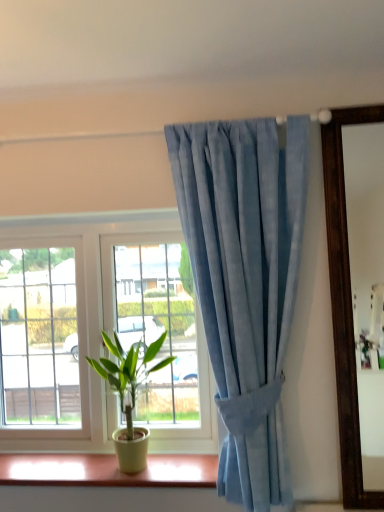
Question: Is light blue fabric curtain at upper center wider than matte yellow plastic at lower center?

Choices:
 (A) yes
 (B) no

Answer: (B)

Question: From the image's perspective, does light blue fabric curtain at upper center appear higher than matte yellow plastic at lower center?

Choices:
 (A) yes
 (B) no

Answer: (A)

Question: Considering the relative positions of light blue fabric curtain at upper center and matte yellow plastic at lower center in the image provided, is light blue fabric curtain at upper center to the left of matte yellow plastic at lower center from the viewer's perspective?

Choices:
 (A) no
 (B) yes

Answer: (A)

Question: Would you consider light blue fabric curtain at upper center to be distant from matte yellow plastic at lower center?

Choices:
 (A) yes
 (B) no

Answer: (B)

Question: Is light blue fabric curtain at upper center behind matte yellow plastic at lower center?

Choices:
 (A) no
 (B) yes

Answer: (A)

Question: Is matte yellow plastic at lower center situated inside green matte plant at lower left or outside?

Choices:
 (A) inside
 (B) outside

Answer: (B)

Question: Considering the positions of matte yellow plastic at lower center and green matte plant at lower left in the image, is matte yellow plastic at lower center taller or shorter than green matte plant at lower left?

Choices:
 (A) tall
 (B) short

Answer: (B)

Question: From a real-world perspective, is matte yellow plastic at lower center above or below green matte plant at lower left?

Choices:
 (A) below
 (B) above

Answer: (A)

Question: Is matte yellow plastic at lower center in front of or behind green matte plant at lower left in the image?

Choices:
 (A) behind
 (B) front

Answer: (A)

Question: In the image, is light blue fabric curtain at upper center on the left side or the right side of green matte plant at lower left?

Choices:
 (A) right
 (B) left

Answer: (A)

Question: Considering the positions of point (195, 211) and point (130, 403), is point (195, 211) closer or farther from the camera than point (130, 403)?

Choices:
 (A) closer
 (B) farther

Answer: (A)

Question: From the image's perspective, is light blue fabric curtain at upper center above or below green matte plant at lower left?

Choices:
 (A) below
 (B) above

Answer: (B)

Question: Is light blue fabric curtain at upper center bigger or smaller than green matte plant at lower left?

Choices:
 (A) small
 (B) big

Answer: (B)

Question: In terms of height, does green matte plant at lower left look taller or shorter compared to matte yellow plastic at lower center?

Choices:
 (A) tall
 (B) short

Answer: (A)

Question: From the image's perspective, relative to matte yellow plastic at lower center, is green matte plant at lower left above or below?

Choices:
 (A) below
 (B) above

Answer: (B)